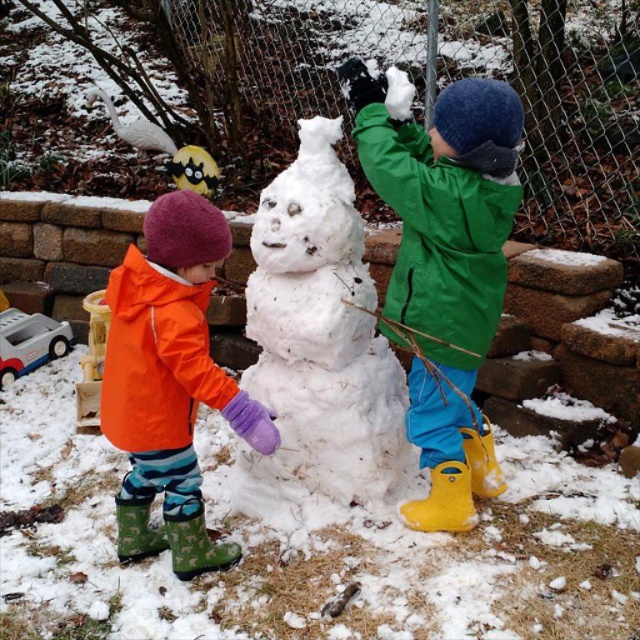
You are a photographer standing at the edge of the snowy backyard. You want to take a picture of the white fluffy snowman at center and the orange waterproof jacket at center. Which object will appear wider in the photo?

The white fluffy snowman at center will appear wider in the photo because its width surpasses that of the orange waterproof jacket at center according to the description.

You are a photographer trying to take a picture of the white fluffy snowman at center without any obstructions. Since the orange waterproof jacket at center is in the way, can you move around to the front of the snowman to get a clear shot?

The orange waterproof jacket at center is behind the white fluffy snowman at center, so moving to the front of the snowman would allow you to take a clear picture without the jacket obstructing the view.